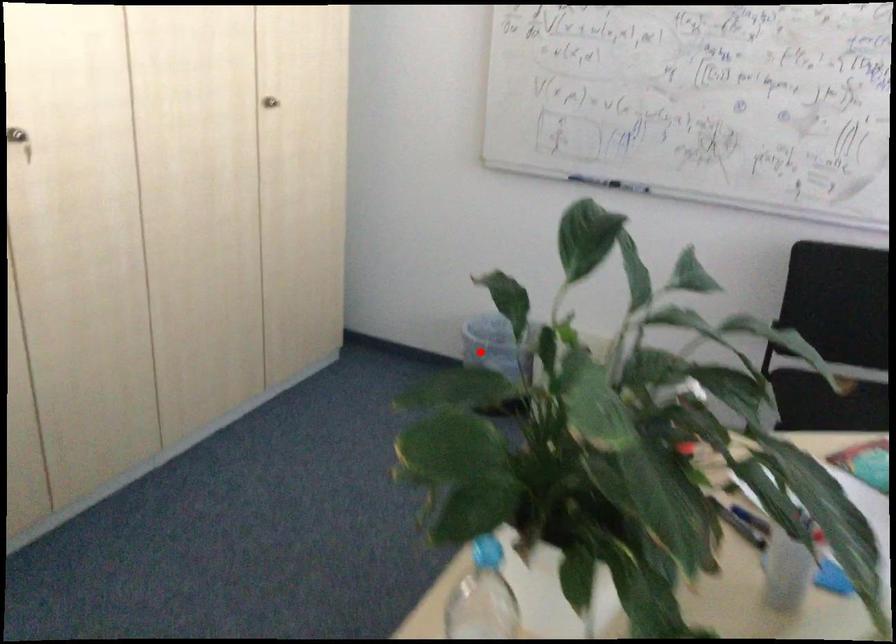
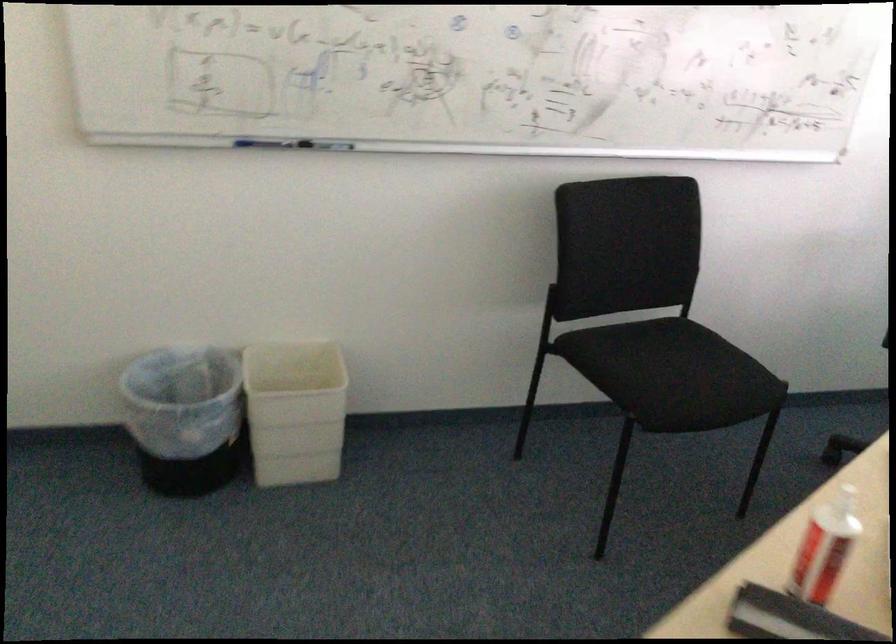
Locate, in the second image, the point that corresponds to the highlighted location in the first image.

(185, 417)